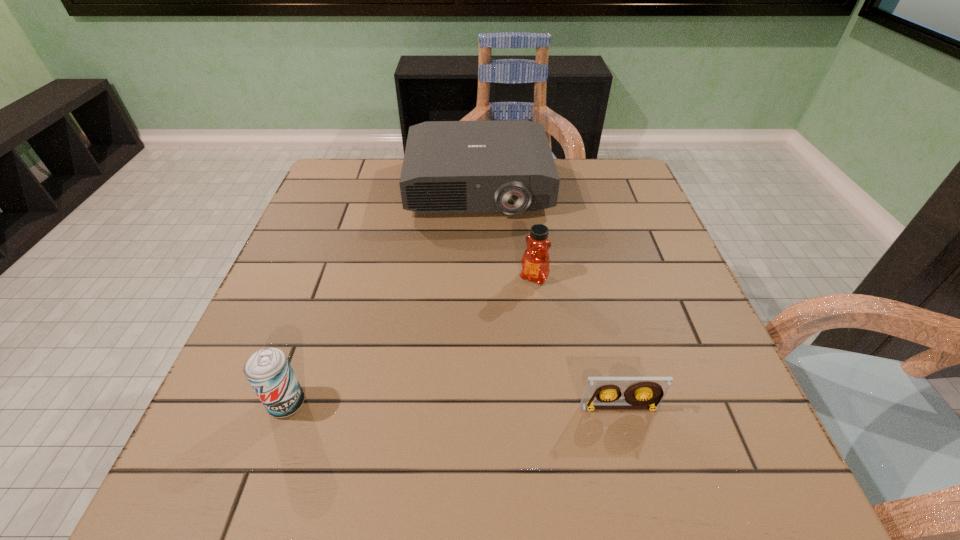
Locate an element on the screen. The image size is (960, 540). vacant space on the desktop that is between the beer can and the shortest object and is positioned on the front-facing side of the farthest object is located at coordinates (491, 406).

In order to click on free spot on the desktop that is between the leftmost object and the videotape and is positioned on the front label of the honey in this screenshot , I will do `click(456, 406)`.